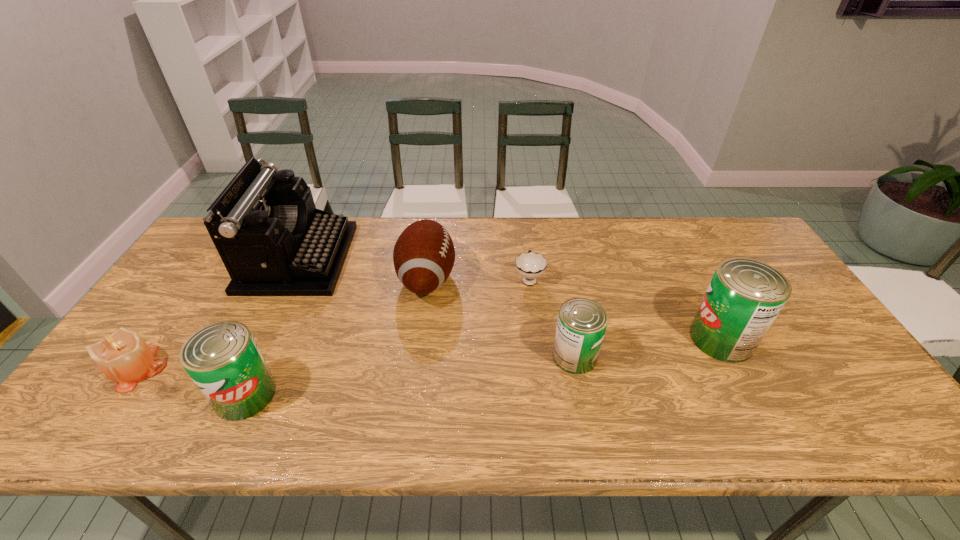
I want to click on free space for an extra can to achieve even spacing, so click(x=417, y=375).